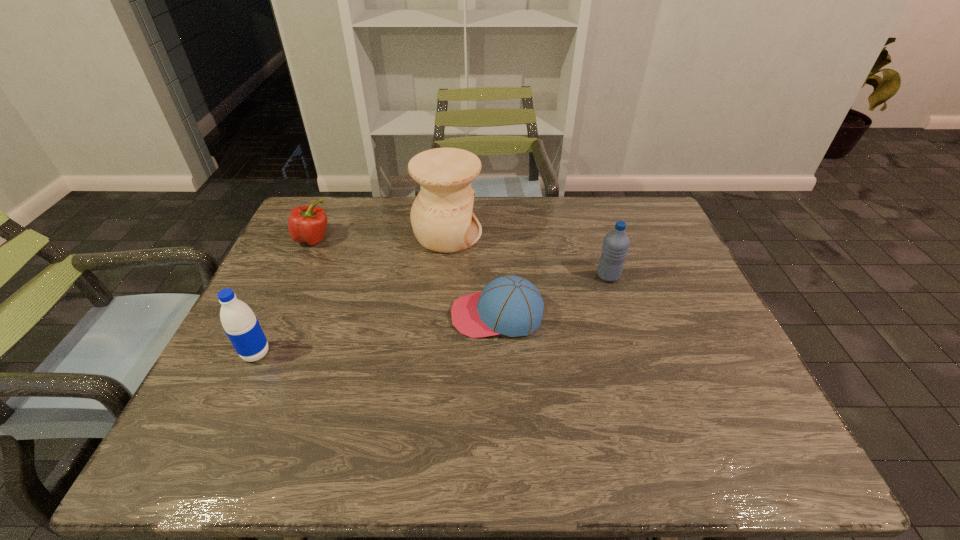
Locate an element on the screen. The width and height of the screenshot is (960, 540). vacant space located on the back of the bell pepper is located at coordinates (332, 199).

You are a GUI agent. You are given a task and a screenshot of the screen. Output one action in this format:
    pyautogui.click(x=<x>, y=<y>)
    Task: Click on the vacant space located 0.240m on the front-facing side of the baseball cap
    Image resolution: width=960 pixels, height=540 pixels.
    Given the screenshot: What is the action you would take?
    pyautogui.click(x=356, y=315)

You are a GUI agent. You are given a task and a screenshot of the screen. Output one action in this format:
    pyautogui.click(x=<x>, y=<y>)
    Task: Click on the free region located on the front-facing side of the baseball cap
    The height and width of the screenshot is (540, 960).
    Given the screenshot: What is the action you would take?
    pyautogui.click(x=324, y=315)

Locate an element on the screen. The image size is (960, 540). vacant space located on the front-facing side of the baseball cap is located at coordinates (420, 315).

Locate an element on the screen. The width and height of the screenshot is (960, 540). pottery located at the far edge is located at coordinates (442, 218).

Locate an element on the screen. This screenshot has width=960, height=540. bell pepper that is positioned at the far edge is located at coordinates (307, 224).

Find the location of a particular element. The width and height of the screenshot is (960, 540). water bottle positioned at the left edge is located at coordinates (238, 320).

The height and width of the screenshot is (540, 960). I want to click on bell pepper that is at the left edge, so click(x=307, y=224).

This screenshot has height=540, width=960. Find the location of `object present at the far left corner`. object present at the far left corner is located at coordinates (307, 224).

This screenshot has width=960, height=540. I want to click on vacant region at the far edge of the desktop, so click(562, 198).